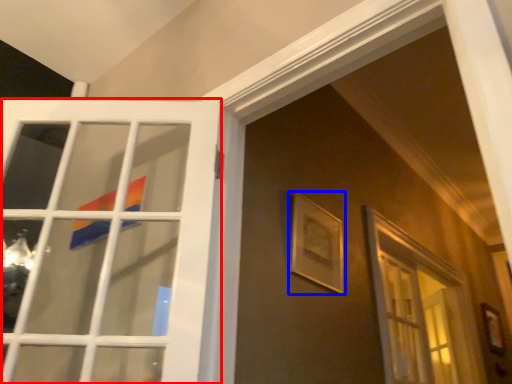
Question: Which point is closer to the camera, door (highlighted by a red box) or picture frame (highlighted by a blue box)?

Choices:
 (A) door
 (B) picture frame

Answer: (A)